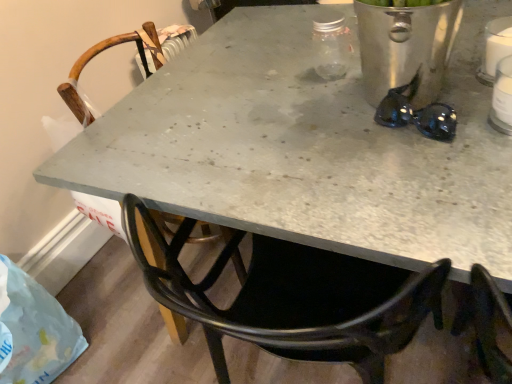
Where is `unoccupied space behind black shiny sunglasses at upper right`? The width and height of the screenshot is (512, 384). unoccupied space behind black shiny sunglasses at upper right is located at coordinates tap(371, 88).